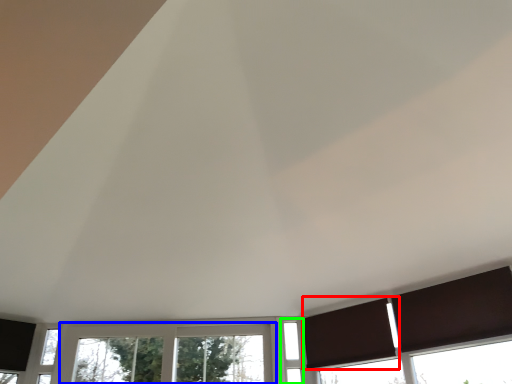
Question: Estimate the real-world distances between objects in this image. Which object is closer to curtain (highlighted by a red box), window (highlighted by a blue box) or window (highlighted by a green box)?

Choices:
 (A) window
 (B) window

Answer: (B)